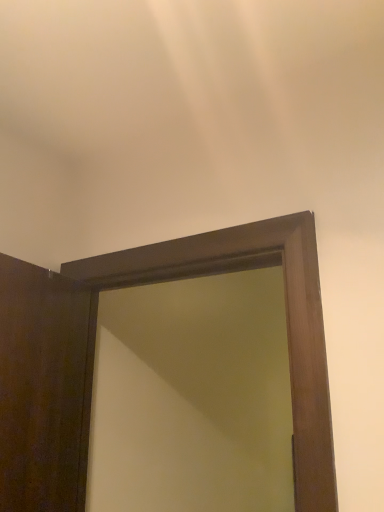
The height and width of the screenshot is (512, 384). Find the location of `brown wooden screen door at center`. brown wooden screen door at center is located at coordinates click(x=94, y=351).

Image resolution: width=384 pixels, height=512 pixels. What do you see at coordinates (94, 351) in the screenshot?
I see `brown wooden screen door at center` at bounding box center [94, 351].

Where is `brown wooden screen door at center`? The image size is (384, 512). brown wooden screen door at center is located at coordinates (94, 351).